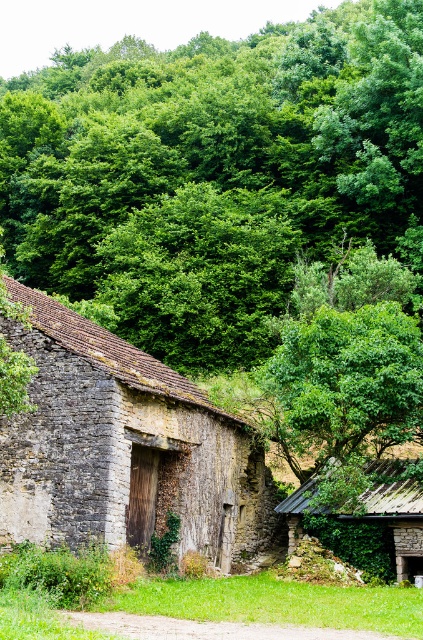
You are standing in front of the rustic stone building and want to determine which of the two points, point [268,193] or point [392,540], is closer to you. Based on the scene description, which point is nearer?

Point [268,193] is further to the camera than point [392,540], so the closer point is point [392,540].

You are an explorer trying to navigate through the forest. You see a green leafy tree at upper center and a rusty metal hut at center. Which object is wider from your perspective?

The green leafy tree at upper center might be wider than the rusty metal hut at center according to the description.